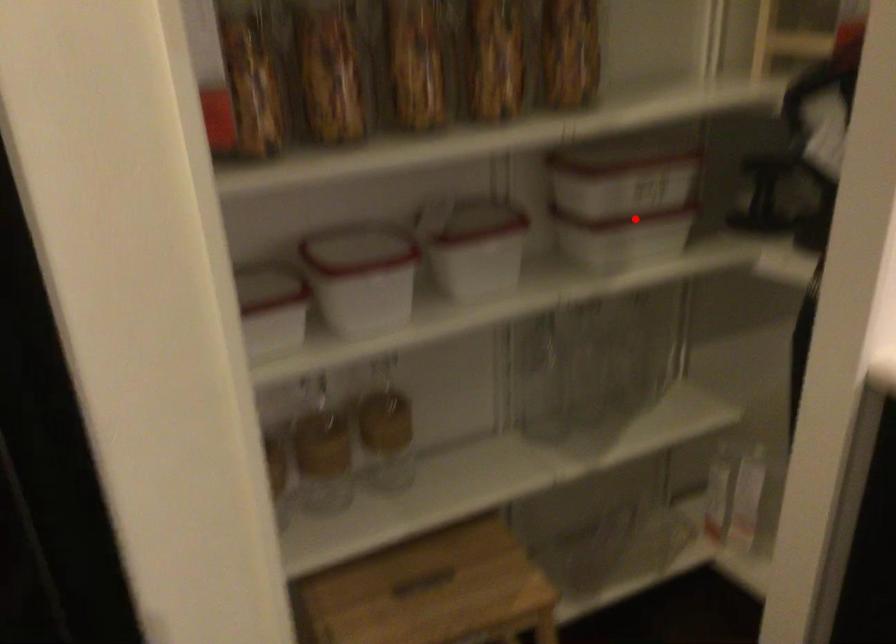
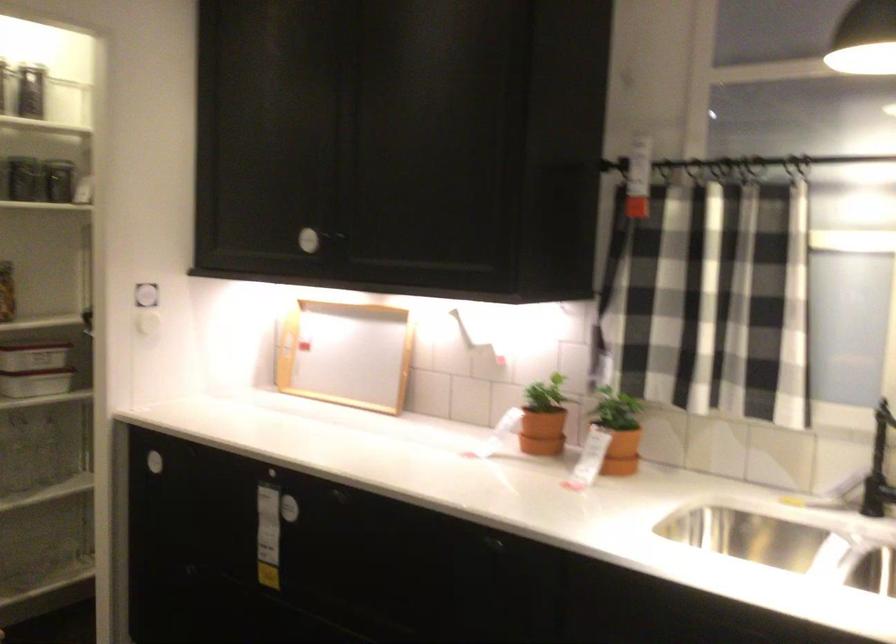
Question: A red point is marked in image1. In image2, is the corresponding 3D point closer to the camera or farther? Reply with the corresponding letter.

Choices:
 (A) The corresponding 3D point is closer.
 (B) The corresponding 3D point is farther.

Answer: (B)